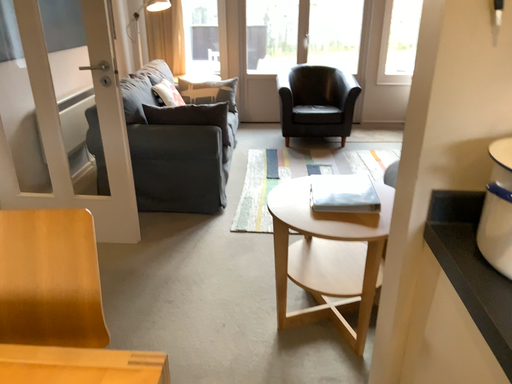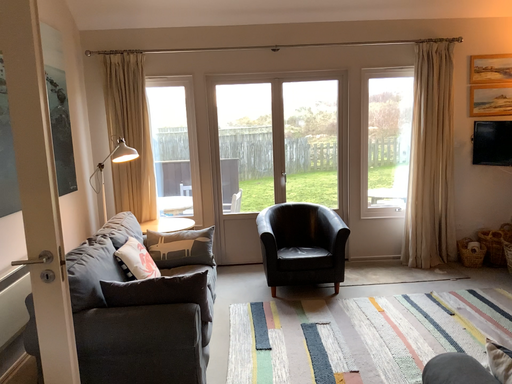
Question: Which way did the camera rotate in the video?

Choices:
 (A) rotated downward
 (B) rotated upward

Answer: (B)